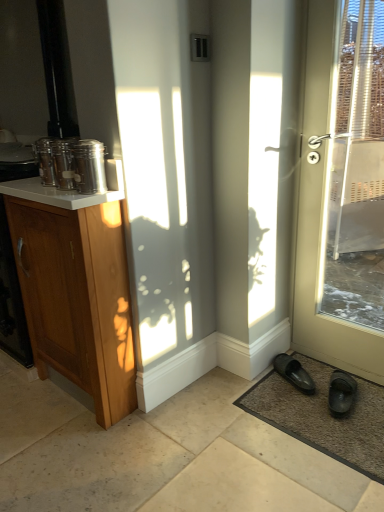
The width and height of the screenshot is (384, 512). I want to click on vacant area to the left of brushed metal canister at upper left, so click(x=49, y=193).